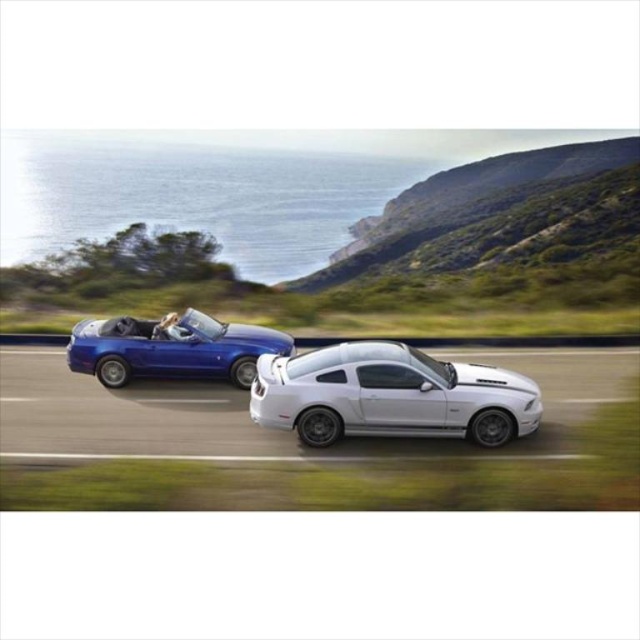
You are a photographer trying to capture the white glossy car at center. You want to place your camera at point (390, 396). Will the camera be positioned directly behind the white glossy car at center?

The point (390, 396) is where the white glossy car at center is located, so placing the camera there would mean the camera is positioned directly at the car, not behind it.

You are a pedestrian standing on the side of the coastal road. You want to cross the road safely. The road is narrow, and there is a white glossy car at center and a shiny metallic blue convertible at left. Which car is closer to you, and can you safely cross between them?

The white glossy car at center is 2.45 meters from the shiny metallic blue convertible at left. Since the road is narrow, the distance between them is only 2.45 meters, which may be too close for safe crossing. It is advisable to wait for both vehicles to pass before attempting to cross.

You are a photographer planning to capture both the white glossy car at center and the shiny metallic blue convertible at left in a single frame. Given their widths, which car should you position closer to the camera to ensure both appear proportionally sized in the photo?

The white glossy car at center is wider than the shiny metallic blue convertible at left. To make them appear proportionally sized in the photo, position the white glossy car at center farther from the camera and the shiny metallic blue convertible at left closer, since wider objects need to be placed farther to match the size of narrower ones in the frame.